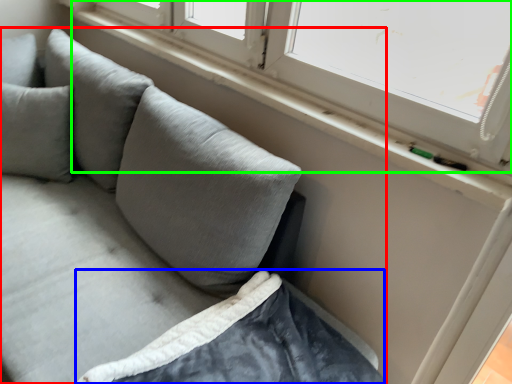
Question: Based on their relative distances, which object is nearer to studio couch (highlighted by a red box)? Choose from sheet (highlighted by a blue box) and window (highlighted by a green box).

Choices:
 (A) sheet
 (B) window

Answer: (A)